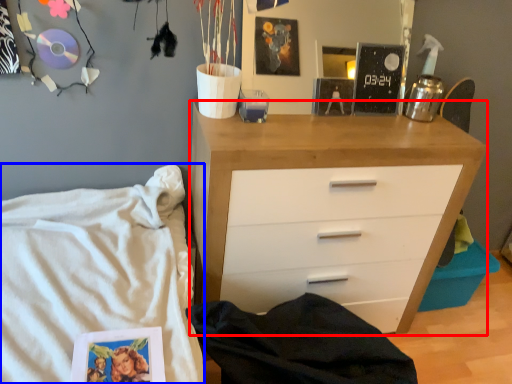
Question: Which point is closer to the camera, chest of drawers (highlighted by a red box) or bed (highlighted by a blue box)?

Choices:
 (A) chest of drawers
 (B) bed

Answer: (B)